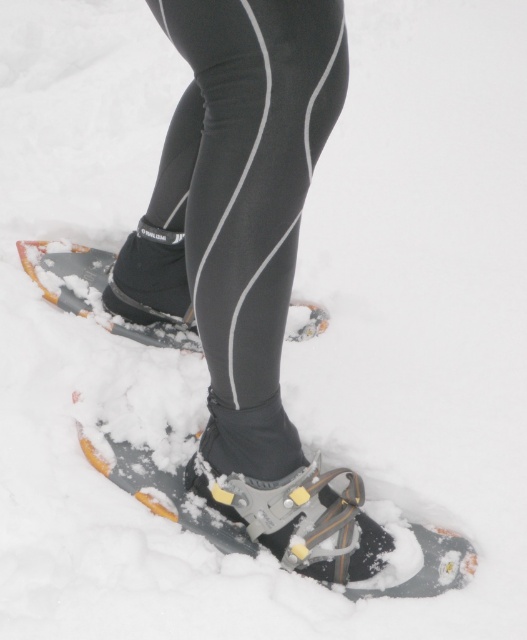
Question: Which of the following is the farthest from the observer?

Choices:
 (A) (280, 188)
 (B) (163, 515)

Answer: (B)

Question: Can you confirm if metallic gray ski boot at lower center is positioned below gray rubber snowshoe at lower center?

Choices:
 (A) no
 (B) yes

Answer: (B)

Question: Does gray rubber snowshoe at lower center appear on the right side of black matte ski boot at center?

Choices:
 (A) no
 (B) yes

Answer: (B)

Question: Which of the following is the farthest from the observer?

Choices:
 (A) black rubber snowshoe at lower center
 (B) gray rubber snowshoe at lower center
 (C) black matte ski boot at center

Answer: (A)

Question: Which object is positioned farthest from the black rubber snowshoe at lower center?

Choices:
 (A) black/stretchy fabric leggings at center
 (B) metallic gray ski boot at lower center
 (C) black matte ski boot at center

Answer: (A)

Question: From the image, what is the correct spatial relationship of gray rubber snowshoe at lower center in relation to black matte ski boot at center?

Choices:
 (A) below
 (B) above

Answer: (A)